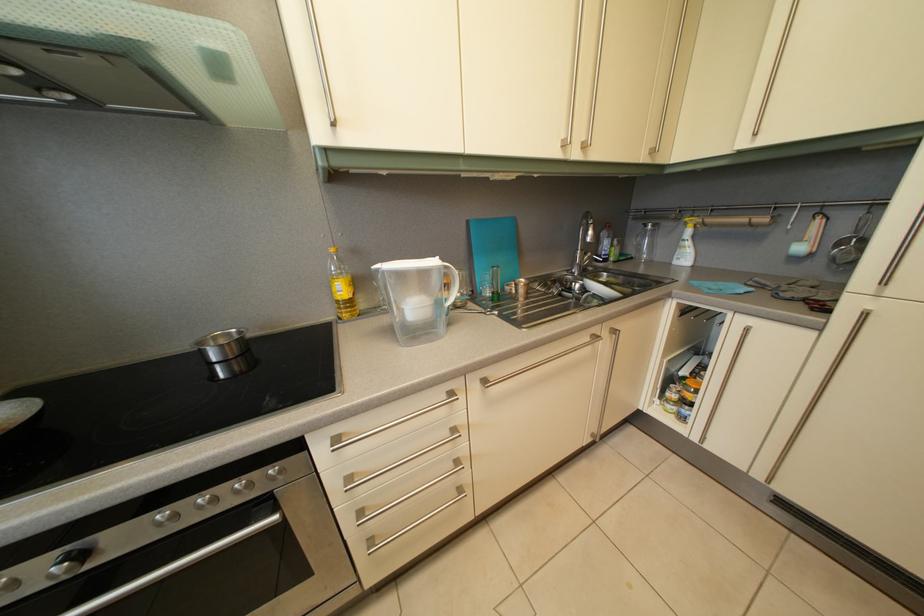
Where is `pump dispenser top`? The width and height of the screenshot is (924, 616). pump dispenser top is located at coordinates (418, 297).